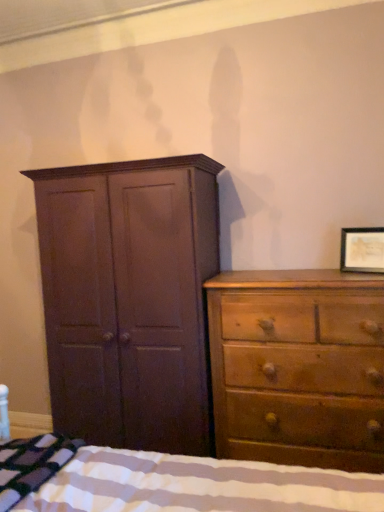
Question: Can you confirm if striped fabric bed at lower left is shorter than wooden framed picture at upper right?

Choices:
 (A) no
 (B) yes

Answer: (A)

Question: Considering the relative sizes of striped fabric bed at lower left and wooden framed picture at upper right in the image provided, is striped fabric bed at lower left thinner than wooden framed picture at upper right?

Choices:
 (A) no
 (B) yes

Answer: (A)

Question: Does striped fabric bed at lower left contain wooden framed picture at upper right?

Choices:
 (A) no
 (B) yes

Answer: (A)

Question: Can you see striped fabric bed at lower left touching wooden framed picture at upper right?

Choices:
 (A) yes
 (B) no

Answer: (B)

Question: From a real-world perspective, is striped fabric bed at lower left located higher than wooden framed picture at upper right?

Choices:
 (A) yes
 (B) no

Answer: (B)

Question: In terms of width, does light brown wood dresser at right look wider or thinner when compared to wooden framed picture at upper right?

Choices:
 (A) thin
 (B) wide

Answer: (B)

Question: Is point (337, 458) positioned closer to the camera than point (372, 227)?

Choices:
 (A) farther
 (B) closer

Answer: (B)

Question: From a real-world perspective, is light brown wood dresser at right physically located above or below wooden framed picture at upper right?

Choices:
 (A) below
 (B) above

Answer: (A)

Question: Looking at the image, does light brown wood dresser at right seem bigger or smaller compared to wooden framed picture at upper right?

Choices:
 (A) big
 (B) small

Answer: (A)

Question: From the image's perspective, relative to light brown wood dresser at right, is striped cotton blanket at lower left above or below?

Choices:
 (A) below
 (B) above

Answer: (A)

Question: Is striped cotton blanket at lower left situated inside light brown wood dresser at right or outside?

Choices:
 (A) outside
 (B) inside

Answer: (A)

Question: Is striped cotton blanket at lower left wider or thinner than light brown wood dresser at right?

Choices:
 (A) thin
 (B) wide

Answer: (B)

Question: Is point pyautogui.click(x=49, y=462) closer or farther from the camera than point pyautogui.click(x=238, y=356)?

Choices:
 (A) closer
 (B) farther

Answer: (A)

Question: Relative to striped cotton blanket at lower left, is wooden framed picture at upper right in front or behind?

Choices:
 (A) front
 (B) behind

Answer: (B)

Question: Based on their positions, is wooden framed picture at upper right located to the left or right of striped cotton blanket at lower left?

Choices:
 (A) right
 (B) left

Answer: (A)